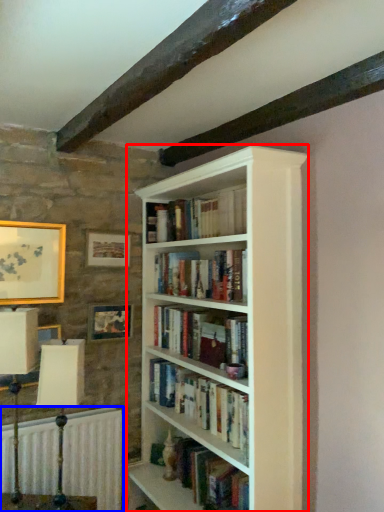
Question: Which object appears farthest to the camera in this image, bookcase (highlighted by a red box) or radiator (highlighted by a blue box)?

Choices:
 (A) bookcase
 (B) radiator

Answer: (B)